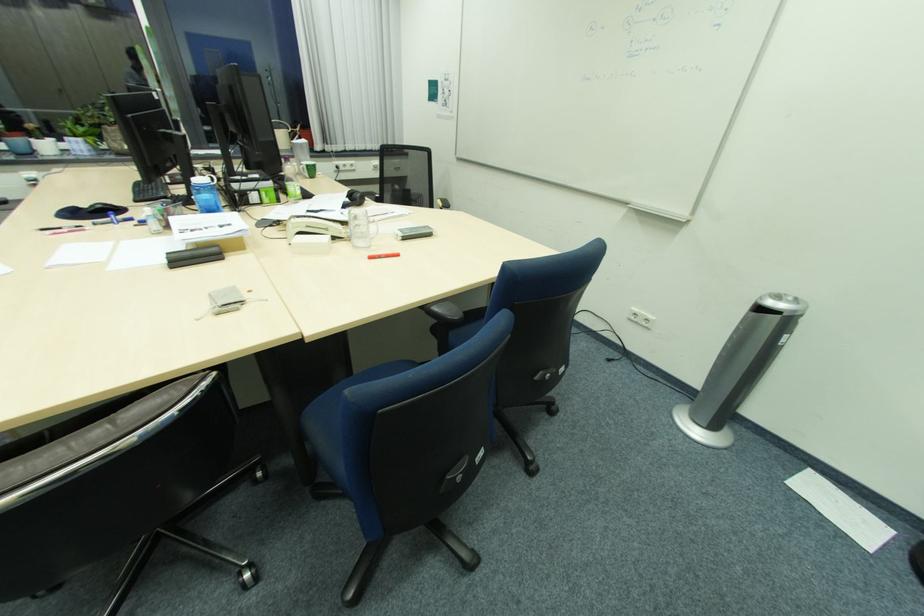
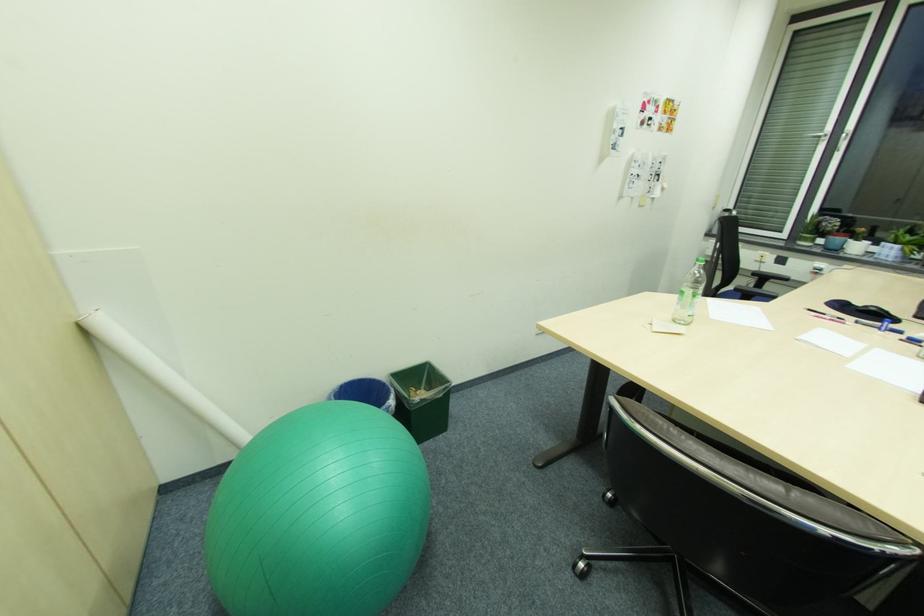
First-person continuous shooting, in which direction is the camera rotating?

The camera rotated toward left-down.